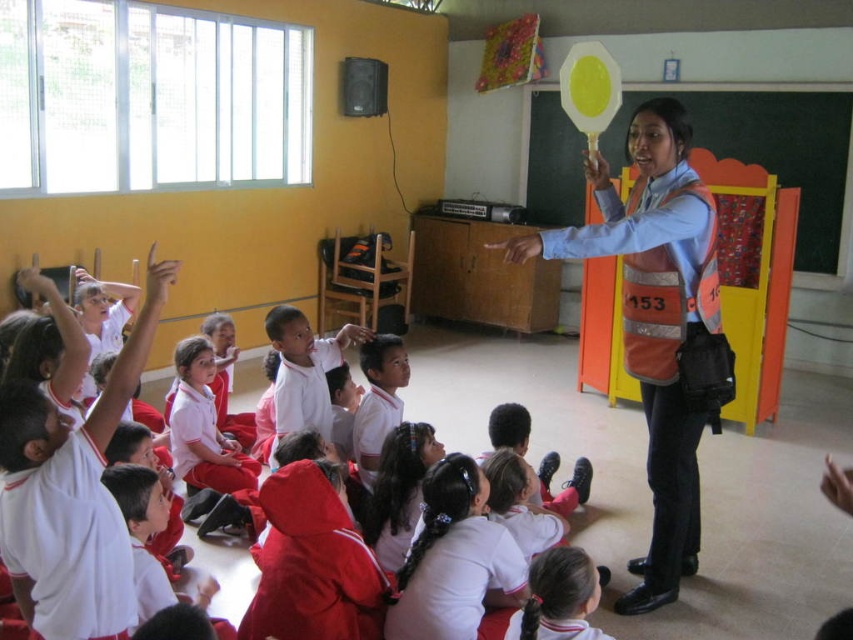
You are a student in the classroom observing the teacher wearing the orange reflective vest at center and the white matte uniform at center. Which clothing item is taller?

The orange reflective vest at center has a greater height compared to the white matte uniform at center, so the orange reflective vest at center is taller.

You are a student sitting in the classroom and notice two items at the center of the room. The items are the white matte hairband at center and the white fabric hair at center. Which one is positioned more to the left?

The white matte hairband at center is to the left of the white fabric hair at center, so the white matte hairband at center is positioned more to the left.